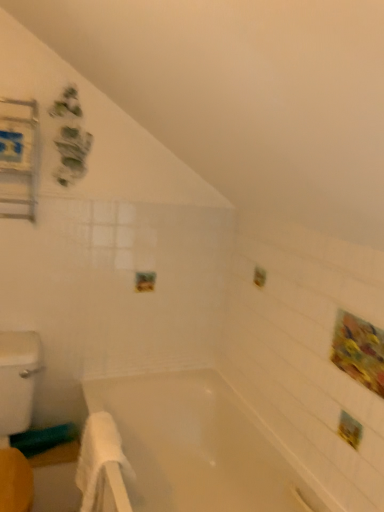
Question: Is white soft towel at lower left next to metallic silver medicine cabinet at upper left?

Choices:
 (A) yes
 (B) no

Answer: (B)

Question: Is white soft towel at lower left shorter than metallic silver medicine cabinet at upper left?

Choices:
 (A) yes
 (B) no

Answer: (A)

Question: Is white soft towel at lower left taller than metallic silver medicine cabinet at upper left?

Choices:
 (A) no
 (B) yes

Answer: (A)

Question: Is white soft towel at lower left smaller than metallic silver medicine cabinet at upper left?

Choices:
 (A) no
 (B) yes

Answer: (A)

Question: Is white soft towel at lower left at the right side of metallic silver medicine cabinet at upper left?

Choices:
 (A) no
 (B) yes

Answer: (B)

Question: In the image, is white glossy bathtub at center on the left side or the right side of white soft towel at lower left?

Choices:
 (A) left
 (B) right

Answer: (B)

Question: From the image's perspective, is white glossy bathtub at center positioned above or below white soft towel at lower left?

Choices:
 (A) above
 (B) below

Answer: (B)

Question: Is white glossy bathtub at center situated inside white soft towel at lower left or outside?

Choices:
 (A) outside
 (B) inside

Answer: (A)

Question: Is point (271, 437) positioned closer to the camera than point (110, 420)?

Choices:
 (A) closer
 (B) farther

Answer: (B)

Question: Is point (114, 489) positioned closer to the camera than point (162, 393)?

Choices:
 (A) closer
 (B) farther

Answer: (A)

Question: From a real-world perspective, is white soft towel at lower left physically located above or below white glossy bathtub at center?

Choices:
 (A) above
 (B) below

Answer: (A)

Question: From the image's perspective, is white soft towel at lower left above or below white glossy bathtub at center?

Choices:
 (A) below
 (B) above

Answer: (B)

Question: Considering the positions of white soft towel at lower left and white glossy bathtub at center in the image, is white soft towel at lower left bigger or smaller than white glossy bathtub at center?

Choices:
 (A) big
 (B) small

Answer: (B)

Question: Does point (8, 198) appear closer or farther from the camera than point (86, 484)?

Choices:
 (A) farther
 (B) closer

Answer: (A)

Question: Choose the correct answer: Is metallic silver medicine cabinet at upper left inside white soft towel at lower left or outside it?

Choices:
 (A) inside
 (B) outside

Answer: (B)